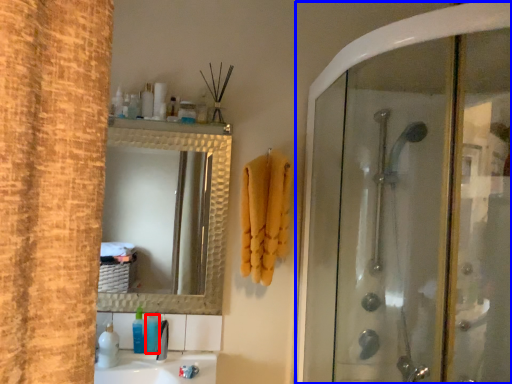
Question: Among these objects, which one is farthest to the camera, toiletry (highlighted by a red box) or screen door (highlighted by a blue box)?

Choices:
 (A) toiletry
 (B) screen door

Answer: (A)